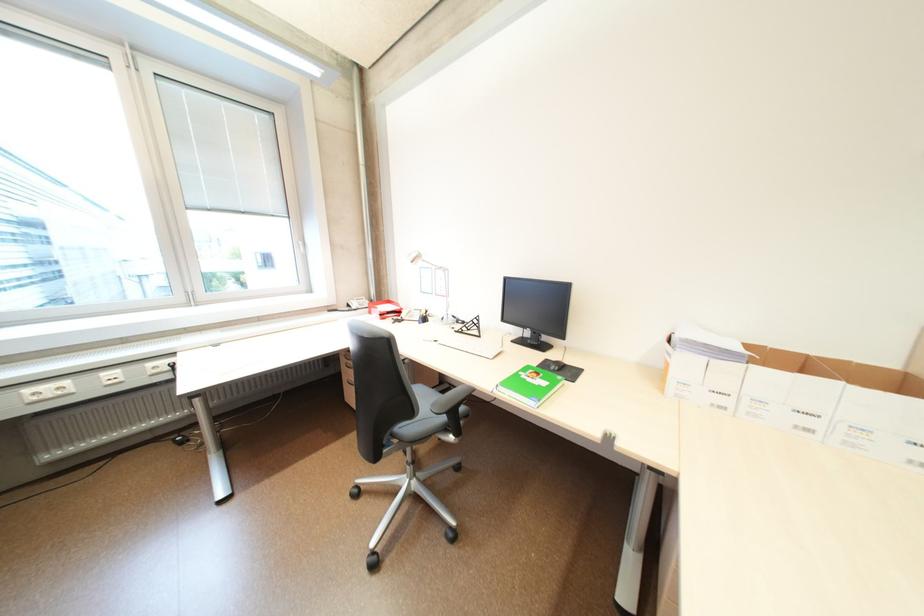
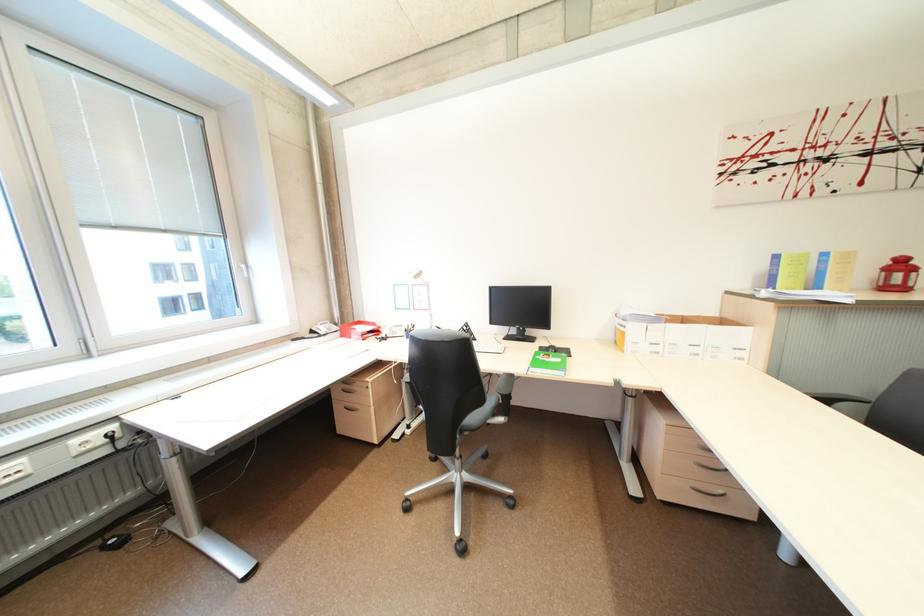
The point at (x=416, y=430) is marked in the first image. Where is the corresponding point in the second image?

(482, 419)